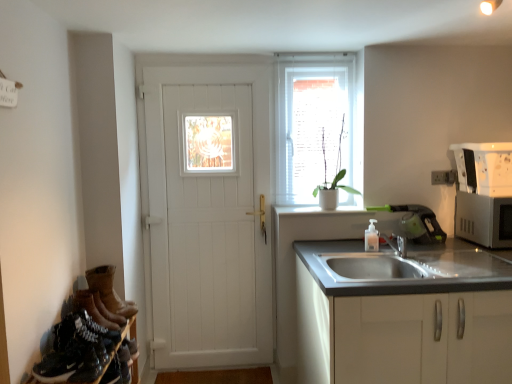
This screenshot has width=512, height=384. In order to click on vacant area to the left of translucent plastic soap dispenser at sink right in this screenshot , I will do `click(342, 243)`.